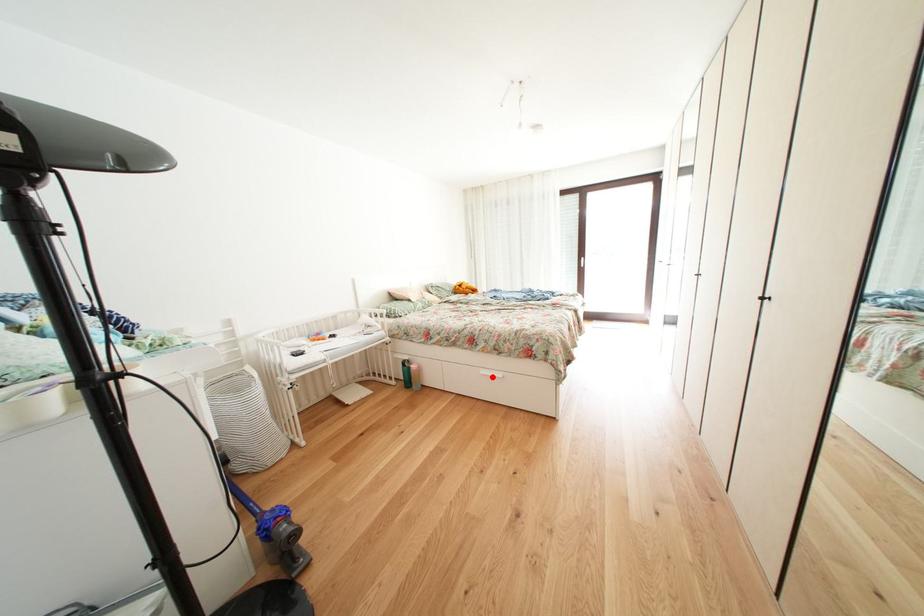
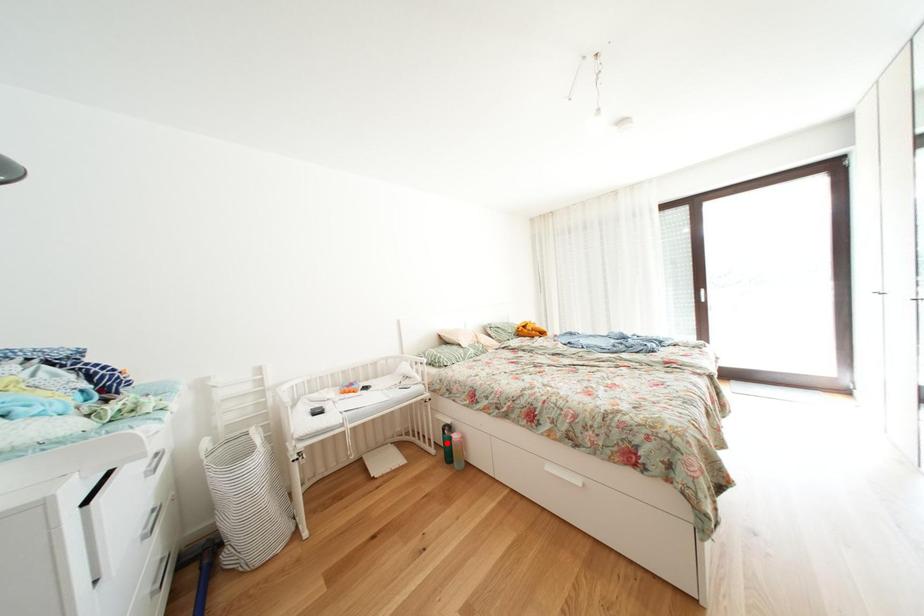
I am providing you with two images of the same scene from different viewpoints. A red point is marked on the first image and another point is marked on the second image. Do the highlighted points in image1 and image2 indicate the same real-world spot?

No